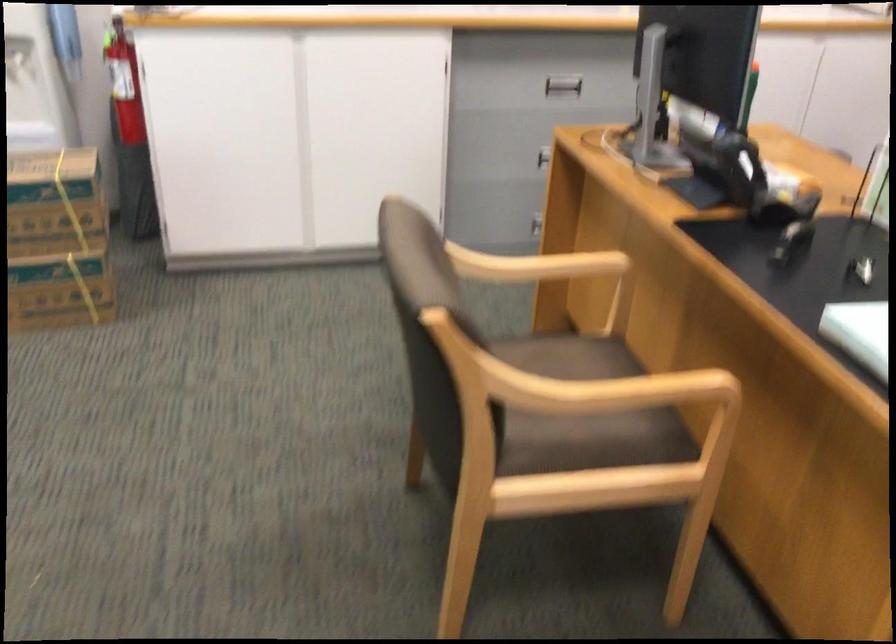
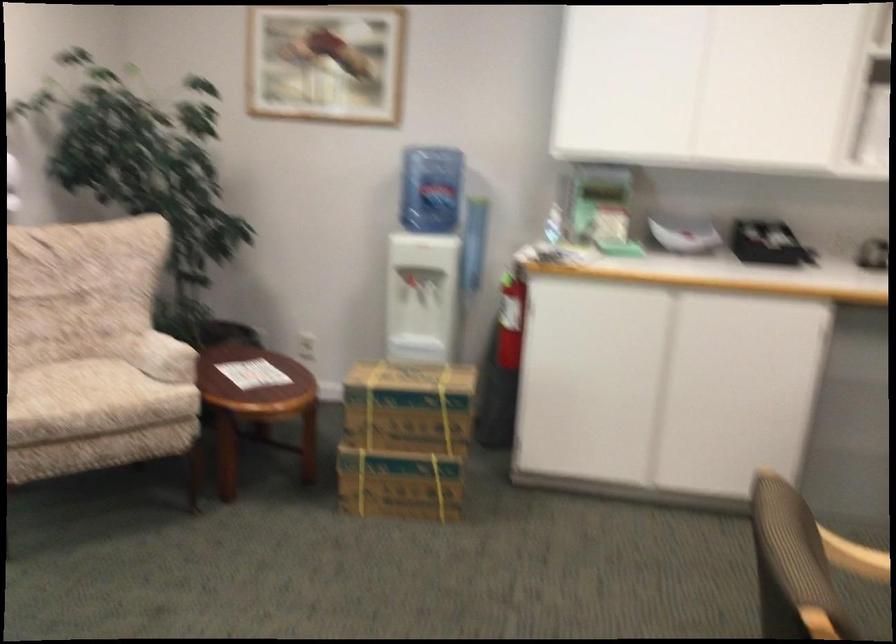
Locate, in the second image, the point that corresponds to pixel 504 315 in the first image.

(866, 607)